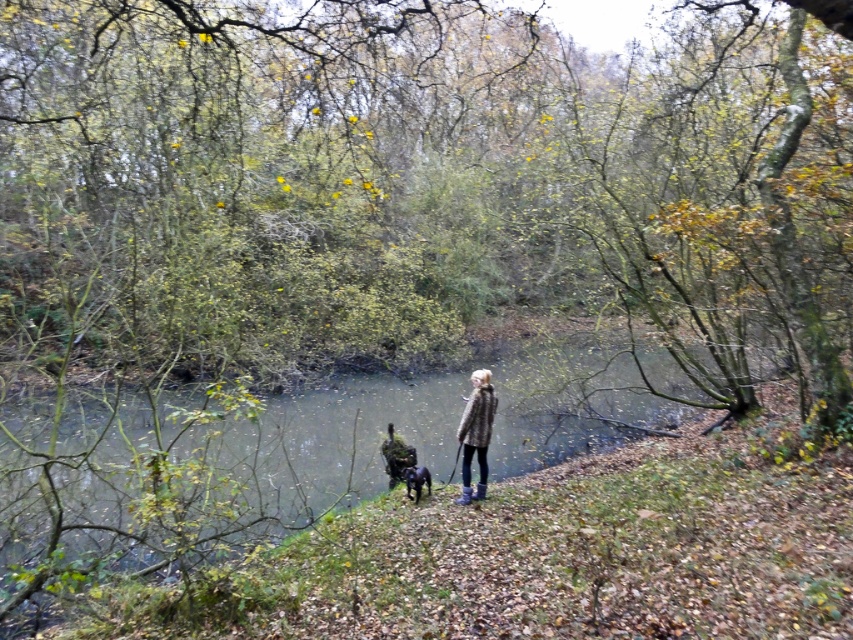
You are a photographer trying to capture a closeup shot of the fuzzy gray coat at center and the shiny black dog at center. Given that your camera has a maximum focus range of 24 inches, will you be able to focus on both subjects simultaneously?

The fuzzy gray coat at center is 24.14 inches from the shiny black dog at center. Since the distance between them is slightly more than 24 inches, the camera cannot focus on both subjects simultaneously within the given range.

You are an observer standing at the edge of the water. You notice the clear water at center and the fuzzy gray coat at center. Which object is wider?

The clear water at center is wider than the fuzzy gray coat at center according to the description.

You are standing at the edge of the water in the autumn scene. There is a point marked at coordinates [201,474]. What does this point represent?

The point at coordinates [201,474] represents clear water at center.